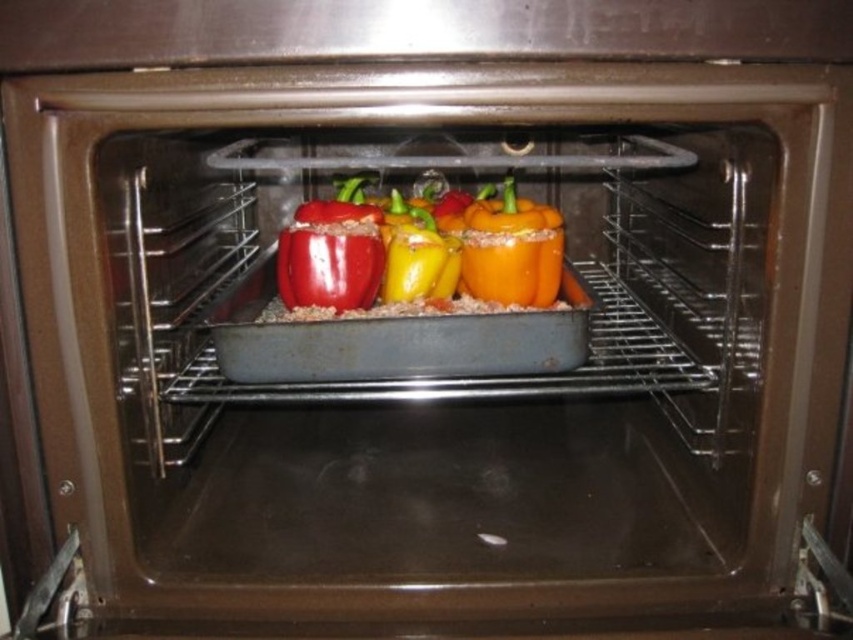
You are a chef preparing to remove the peppers from the oven. The shiny red bell pepper at center is wider than the orange matte bell pepper at center. Which pepper should you grab first to ensure you can fit both into a rectangular container that is 15 cm wide?

The shiny red bell pepper at center is wider than the orange matte bell pepper at center, so you should grab the shiny red bell pepper at center first to ensure it fits into the container before placing the narrower orange matte bell pepper at center.

You are standing in front of an oven with its door open. There is a baking tray inside with four bell peppers of different colors arranged in a row. You notice a specific point marked at coordinates point (x=428, y=252). Which bell pepper is located at that point?

The shiny red bell pepper at center is located at point (x=428, y=252).

You are a chef preparing to remove the peppers from the oven. You need to know which pepper is taller so you can adjust your grip accordingly. Which one is taller between the shiny red bell pepper at center and the orange matte bell pepper at center?

The shiny red bell pepper at center has a greater height compared to the orange matte bell pepper at center, so it is taller.